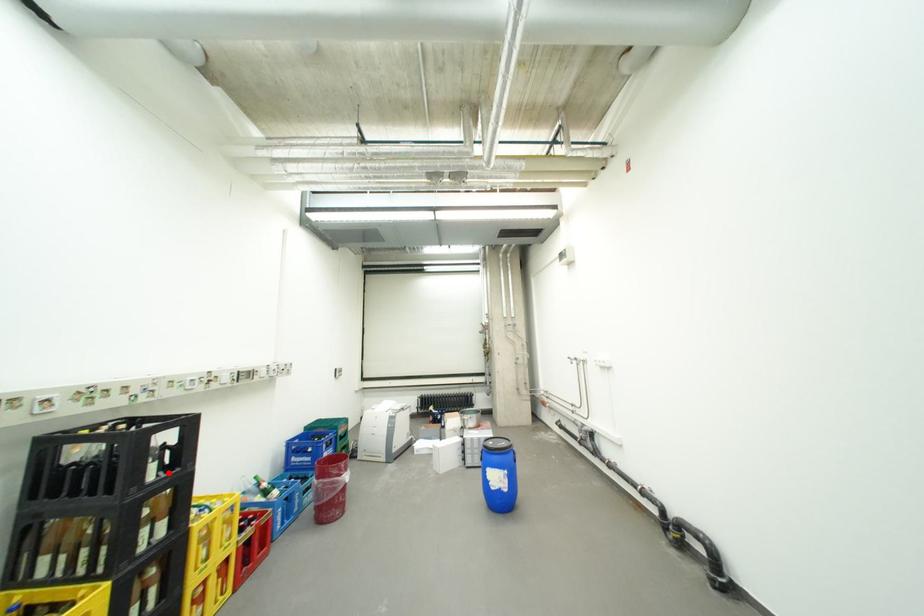
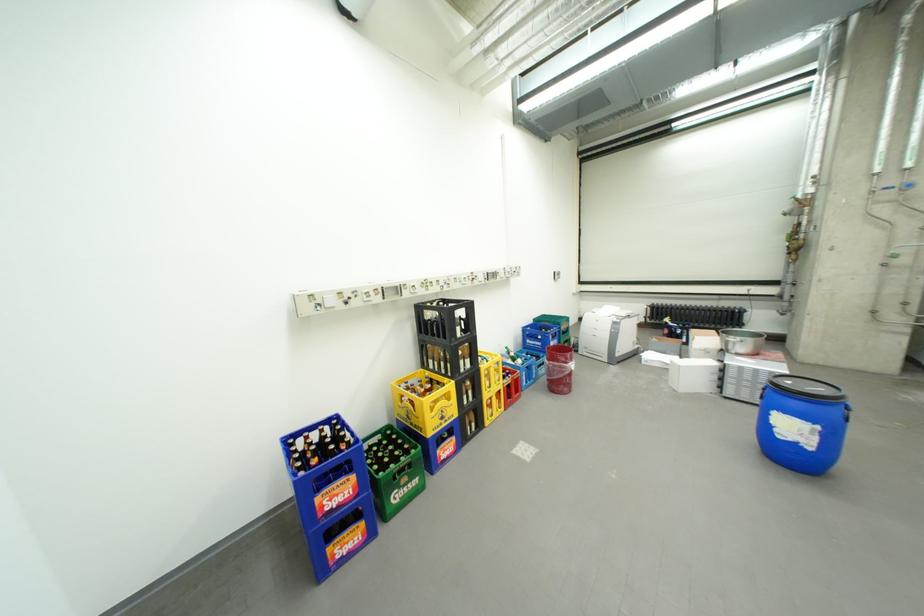
Where in the second image is the point corresponding to the highlighted location from the first image?

(470, 333)